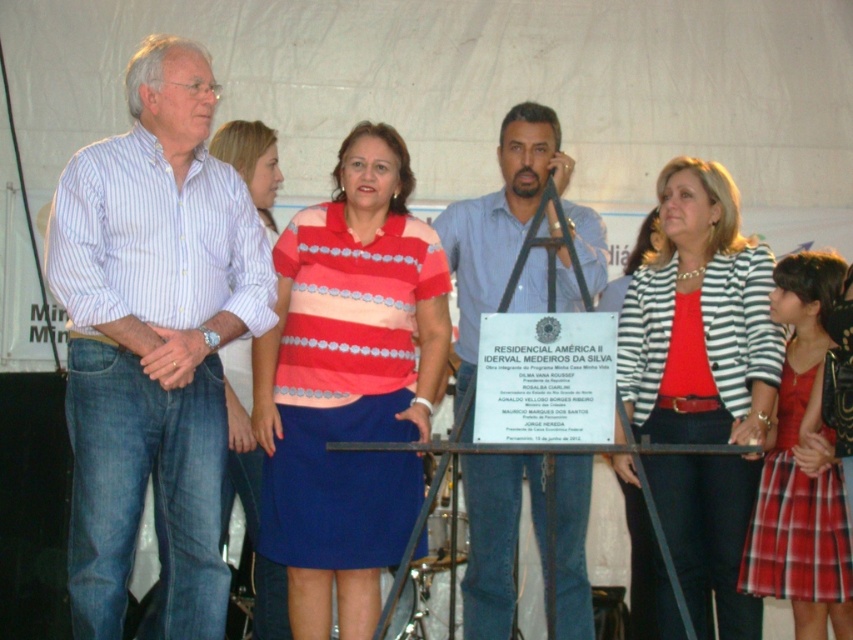
You are a photographer at the event and want to capture both the striped cotton shirt at center and the striped cotton jacket at center in a single frame. Your camera has a minimum focus distance of 4 feet. Can you take a photo that includes both objects without moving either?

The distance between the striped cotton shirt at center and the striped cotton jacket at center is 5.04 feet. Since this distance is greater than the camera minimum focus distance of 4 feet, you can capture both in a single frame without moving them.